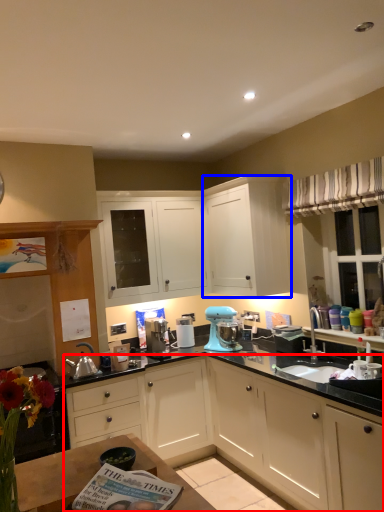
Question: Which of the following is the farthest to the observer, cabinetry (highlighted by a red box) or cabinetry (highlighted by a blue box)?

Choices:
 (A) cabinetry
 (B) cabinetry

Answer: (B)